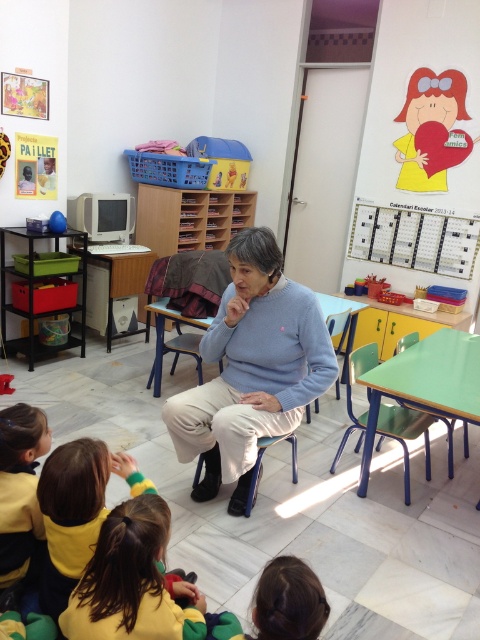
Question: From the image, what is the correct spatial relationship of yellow-green sweater at lower left in relation to blue metal chair at lower center?

Choices:
 (A) left
 (B) right

Answer: (A)

Question: Based on their relative distances, which object is farther from the light blue fabric chair at center?

Choices:
 (A) yellow sweater at lower left
 (B) light blue sweater at center

Answer: (A)

Question: Is light blue sweater at center to the left of yellow-green sweater at lower left from the viewer's perspective?

Choices:
 (A) yes
 (B) no

Answer: (B)

Question: Which object is the closest to the brown hair at lower center?

Choices:
 (A) yellow sweater at lower left
 (B) blue metal chair at lower center
 (C) metallic blue chair at lower right

Answer: (A)

Question: Does yellow-green sweater at lower left have a larger size compared to blue metal chair at lower center?

Choices:
 (A) no
 (B) yes

Answer: (A)

Question: Which of these objects is positioned farthest from the blue metal chair at lower center?

Choices:
 (A) yellow sweater at lower left
 (B) brown hair at lower center
 (C) light blue sweater at center
 (D) light blue fabric chair at center

Answer: (A)